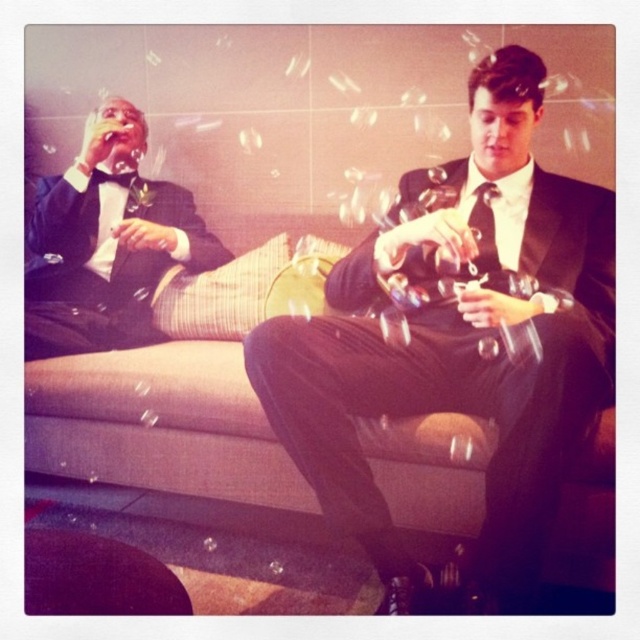
Question: Is matte black suit at center thinner than beige fabric couch at center?

Choices:
 (A) yes
 (B) no

Answer: (A)

Question: Which object is farther from the camera taking this photo?

Choices:
 (A) matte black tuxedo at left
 (B) matte black suit at center

Answer: (A)

Question: Does beige fabric couch at center lie behind matte black tuxedo at left?

Choices:
 (A) yes
 (B) no

Answer: (B)

Question: Estimate the real-world distances between objects in this image. Which object is farther from the matte black tuxedo at left?

Choices:
 (A) matte black suit at center
 (B) beige fabric couch at center

Answer: (A)

Question: Does beige fabric couch at center have a larger size compared to matte black tuxedo at left?

Choices:
 (A) no
 (B) yes

Answer: (B)

Question: Which of the following is the closest to the observer?

Choices:
 (A) matte black suit at center
 (B) matte black tuxedo at left

Answer: (A)